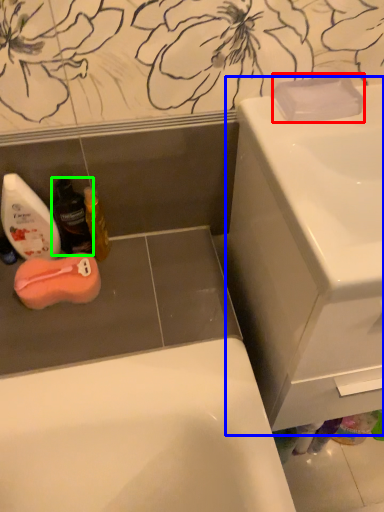
Question: Which object is positioned farthest from soap (highlighted by a red box)? Select from sink (highlighted by a blue box) and mouthwash (highlighted by a green box).

Choices:
 (A) sink
 (B) mouthwash

Answer: (B)